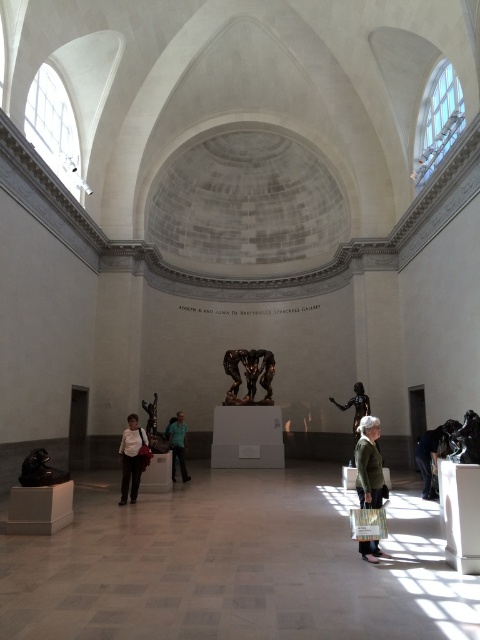
Does green textured sweater at center have a larger size compared to bronze/metallic figure at center?

Indeed, green textured sweater at center has a larger size compared to bronze/metallic figure at center.

Does point (377, 493) come closer to viewer compared to point (242, 356)?

Yes, point (377, 493) is closer to viewer.

Is point (363, 545) closer to camera compared to point (271, 371)?

That is True.

The image size is (480, 640). In order to click on green textured sweater at center in this screenshot , I will do pyautogui.click(x=369, y=465).

Which is below, green textured sweater at center or teal fabric shirt at center?

teal fabric shirt at center

Which is more to the right, green textured sweater at center or teal fabric shirt at center?

green textured sweater at center

You are a GUI agent. You are given a task and a screenshot of the screen. Output one action in this format:
    pyautogui.click(x=<x>, y=<y>)
    Task: Click on the green textured sweater at center
    The image size is (480, 640).
    Given the screenshot: What is the action you would take?
    pyautogui.click(x=369, y=465)

Who is lower down, green textured sweater at center or bronze statue at center?

bronze statue at center is lower down.

You are a GUI agent. You are given a task and a screenshot of the screen. Output one action in this format:
    pyautogui.click(x=<x>, y=<y>)
    Task: Click on the green textured sweater at center
    
    Given the screenshot: What is the action you would take?
    369,465

I want to click on green textured sweater at center, so click(369, 465).